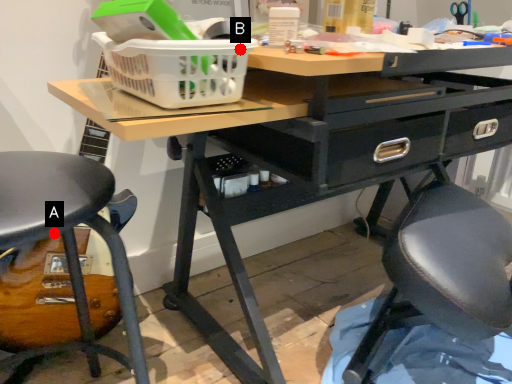
Question: Two points are circled on the image, labeled by A and B beside each circle. Which point appears farthest from the camera in this image?

Choices:
 (A) A is further
 (B) B is further

Answer: (A)